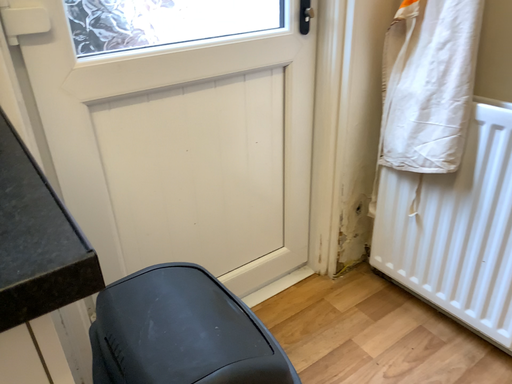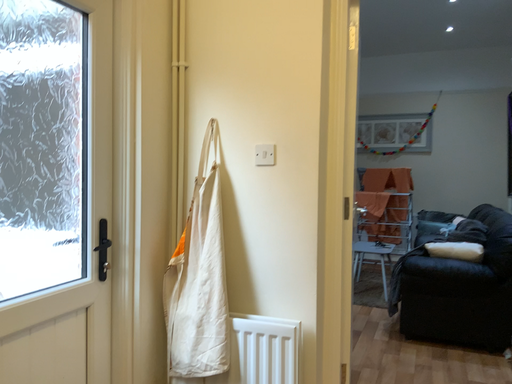
Question: How did the camera likely rotate when shooting the video?

Choices:
 (A) rotated left
 (B) rotated right

Answer: (B)